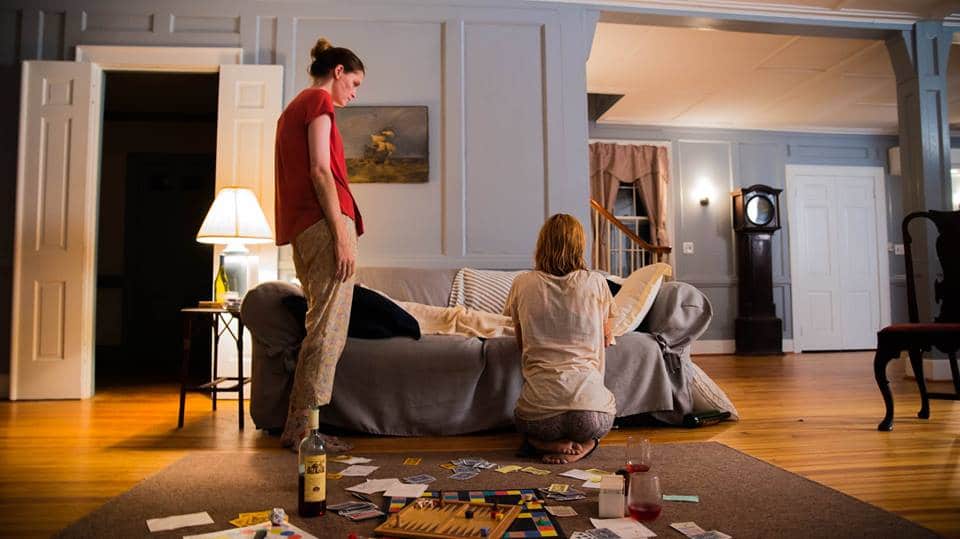
Locate an element on the screen. The width and height of the screenshot is (960, 539). wine bottle is located at coordinates (309, 460).